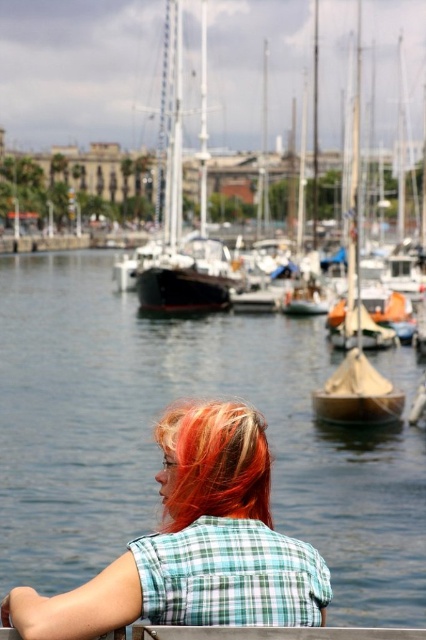
You are standing at the edge of the waterfront scene and want to know if you can reach the plaid fabric shirt at lower center before a seagull flying at 10 meters per second. The seagull is 50 meters away from you. Can you make it?

The plaid fabric shirt at lower center is 44.09 meters away from the viewer. The seagull is 50 meters away and flying at 10 meters per second. To determine who reaches the shirt first, calculate the time it takes for the seagull to cover the 50 meters distance. Time equals distance divided by speed, so 50 meters divided by 10 meters per second equals 5 seconds. If you can cover the 44.09 meters distance in less than 5 seconds, you can reach the shirt before the seagull. However, the question does not state